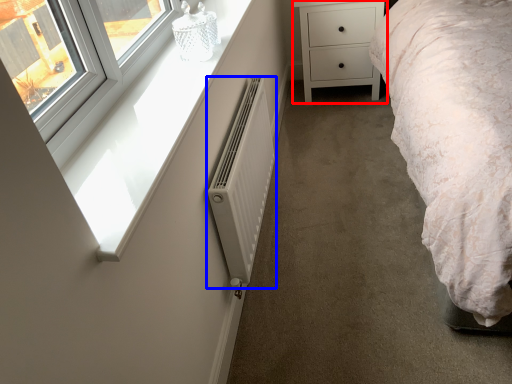
Question: Which object is further to the camera taking this photo, chest of drawers (highlighted by a red box) or radiator (highlighted by a blue box)?

Choices:
 (A) chest of drawers
 (B) radiator

Answer: (A)